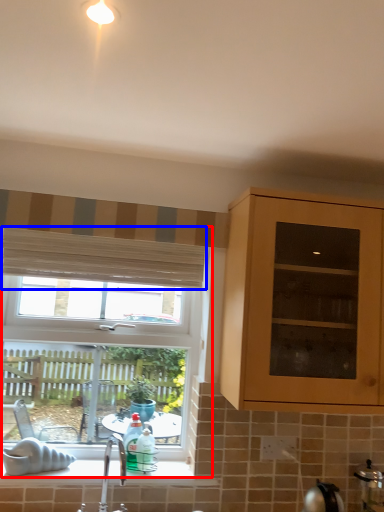
Question: Which object is further to the camera taking this photo, window (highlighted by a red box) or curtain (highlighted by a blue box)?

Choices:
 (A) window
 (B) curtain

Answer: (B)